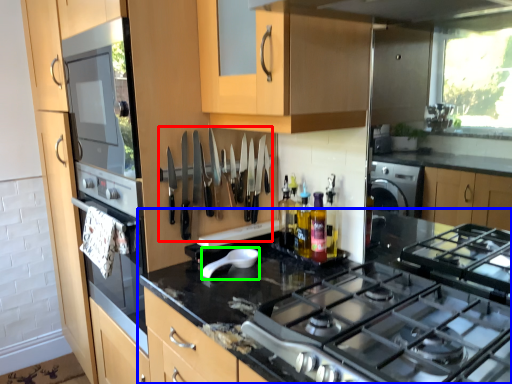
Question: Estimate the real-world distances between objects in this image. Which object is farther from cutlery (highlighted by a red box), countertop (highlighted by a blue box) or appliance (highlighted by a green box)?

Choices:
 (A) countertop
 (B) appliance

Answer: (A)